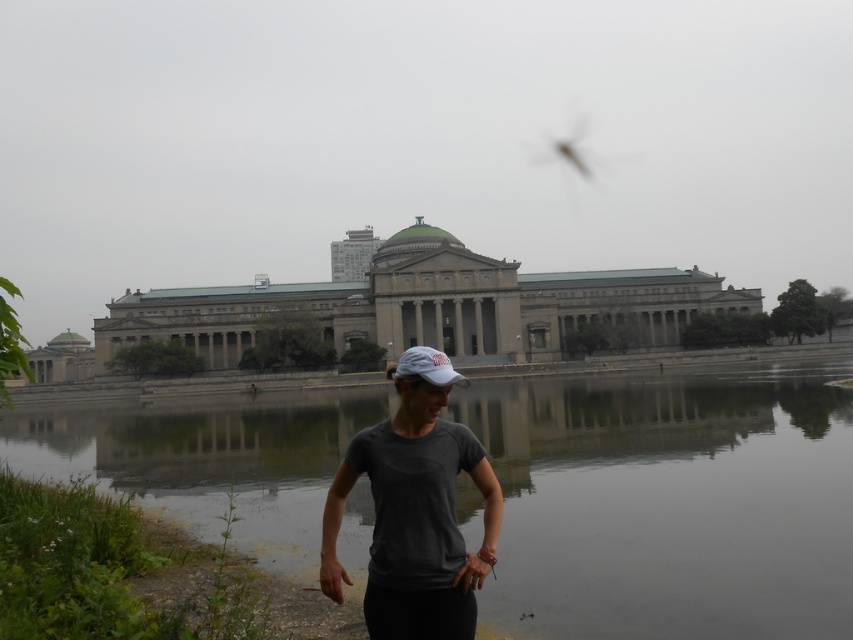
Which is more to the left, dark gray matte t-shirt at center or white matte baseball cap at center?

dark gray matte t-shirt at center

Is dark gray matte t-shirt at center to the right of white matte baseball cap at center from the viewer's perspective?

No, dark gray matte t-shirt at center is not to the right of white matte baseball cap at center.

Image resolution: width=853 pixels, height=640 pixels. Describe the element at coordinates (415, 509) in the screenshot. I see `dark gray matte t-shirt at center` at that location.

This screenshot has height=640, width=853. Find the location of `dark gray matte t-shirt at center`. dark gray matte t-shirt at center is located at coordinates (415, 509).

Does clear water at lower center have a smaller size compared to gray stone building at center?

Correct, clear water at lower center occupies less space than gray stone building at center.

Locate an element on the screen. clear water at lower center is located at coordinates (670, 502).

In order to click on clear water at lower center in this screenshot , I will do `click(670, 502)`.

Who is more distant from viewer, (264, 435) or (405, 368)?

Point (264, 435)

Is clear water at lower center further to camera compared to white matte baseball cap at center?

No, it is not.

This screenshot has height=640, width=853. I want to click on clear water at lower center, so click(670, 502).